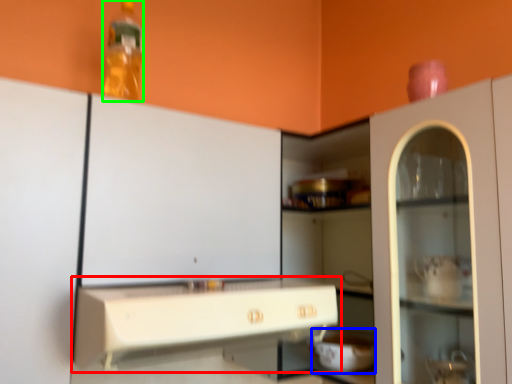
Question: Which is farther away from countertop (highlighted by a red box)? appliance (highlighted by a blue box) or bottle (highlighted by a green box)?

Choices:
 (A) appliance
 (B) bottle

Answer: (B)